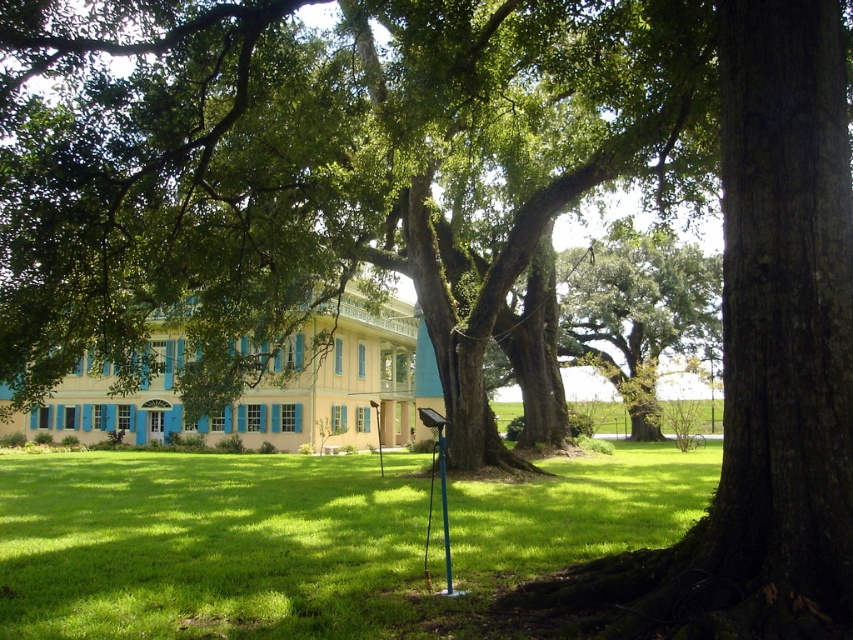
Which is above, green leafy tree at center or green grass at center?

green leafy tree at center is above.

Can you confirm if green leafy tree at center is positioned to the left of green grass at center?

Yes, green leafy tree at center is to the left of green grass at center.

Is point (26, 257) behind point (631, 449)?

That is False.

Image resolution: width=853 pixels, height=640 pixels. What are the coordinates of `green leafy tree at center` in the screenshot? It's located at (314, 168).

Does green leafy tree at center appear on the right side of green plastic pole at center?

Incorrect, green leafy tree at center is not on the right side of green plastic pole at center.

Between green leafy tree at center and green plastic pole at center, which one has more height?

Standing taller between the two is green leafy tree at center.

Between point (79, 4) and point (437, 433), which one is positioned in front?

Positioned in front is point (437, 433).

Where is `green leafy tree at center`? This screenshot has height=640, width=853. green leafy tree at center is located at coordinates (314, 168).

Looking at this image, is green grass at center above green plastic pole at center?

No.

Does green grass at center lie behind green plastic pole at center?

No.

Is point (57, 502) behind point (447, 561)?

Yes, it is behind point (447, 561).

Locate an element on the screen. The height and width of the screenshot is (640, 853). green grass at center is located at coordinates (305, 538).